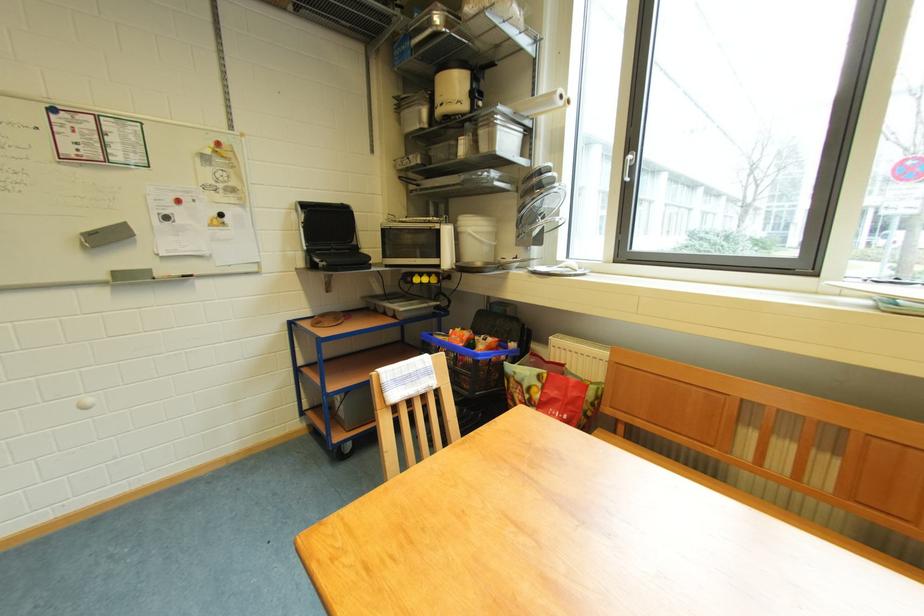
This screenshot has height=616, width=924. I want to click on blue shopping basket, so click(480, 353).